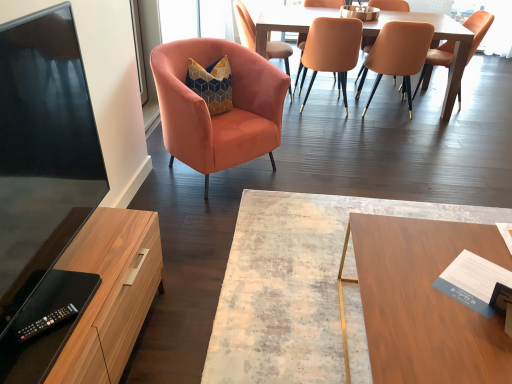
Question: From a real-world perspective, relative to matte orange chair at upper center, which appears as the fifth chair when viewed from the left, is velvet orange chair at upper left, which is counted as the 5th chair, starting from the right, vertically above or below?

Choices:
 (A) above
 (B) below

Answer: (B)

Question: Based on their positions, is velvet orange chair at upper left, the 2th chair in the left-to-right sequence, located to the left or right of matte orange chair at upper center, the 2th chair when ordered from right to left?

Choices:
 (A) right
 (B) left

Answer: (B)

Question: Estimate the real-world distances between objects in this image. Which object is farther from the matte orange chair at center, placed as the 3th chair when sorted from right to left?

Choices:
 (A) matte orange chair at upper right, positioned as the 1th chair in right-to-left order
 (B) wooden rectangular table at center
 (C) matte orange chair at upper center, which is the 3th chair from left to right
 (D) light brown wooden table at center
 (E) black plastic remote control at lower left

Answer: (E)

Question: Which is farther from the black plastic remote control at lower left?

Choices:
 (A) matte black tv at left
 (B) velvet orange armchair at left, placed as the first chair when sorted from left to right
 (C) wooden cabinet at left
 (D) wooden rectangular table at center
 (E) velvet orange chair at upper left, the 2th chair in the left-to-right sequence

Answer: (E)